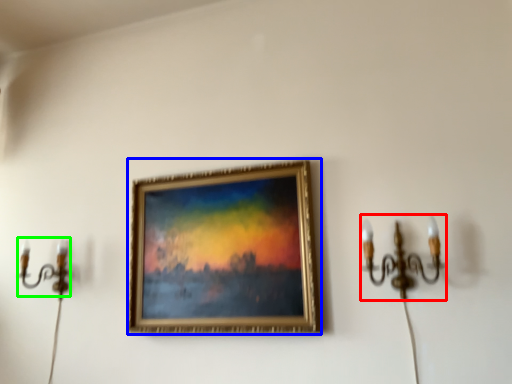
Question: Considering the real-world distances, which object is closest to candle holder (highlighted by a red box)? picture frame (highlighted by a blue box) or candle holder (highlighted by a green box).

Choices:
 (A) picture frame
 (B) candle holder

Answer: (A)